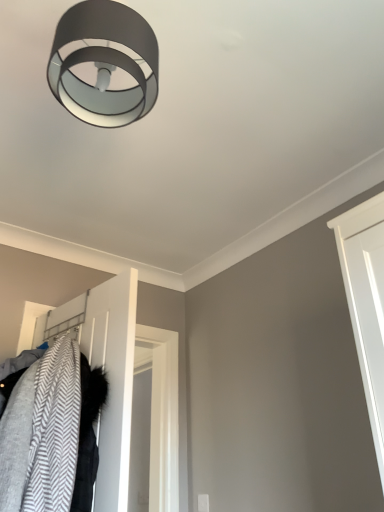
Question: Does point (79, 330) appear closer or farther from the camera than point (117, 57)?

Choices:
 (A) farther
 (B) closer

Answer: (A)

Question: Considering their positions, is white matte door at lower left located in front of or behind matte gray ring light at upper center?

Choices:
 (A) behind
 (B) front

Answer: (A)

Question: From a real-world perspective, is white matte door at lower left positioned above or below matte gray ring light at upper center?

Choices:
 (A) above
 (B) below

Answer: (B)

Question: Is matte gray ring light at upper center bigger or smaller than white matte door at lower left?

Choices:
 (A) big
 (B) small

Answer: (B)

Question: In terms of height, does matte gray ring light at upper center look taller or shorter compared to white matte door at lower left?

Choices:
 (A) tall
 (B) short

Answer: (B)

Question: From a real-world perspective, relative to white matte door at lower left, is matte gray ring light at upper center vertically above or below?

Choices:
 (A) below
 (B) above

Answer: (B)

Question: In terms of width, does matte gray ring light at upper center look wider or thinner when compared to white matte door at lower left?

Choices:
 (A) wide
 (B) thin

Answer: (A)